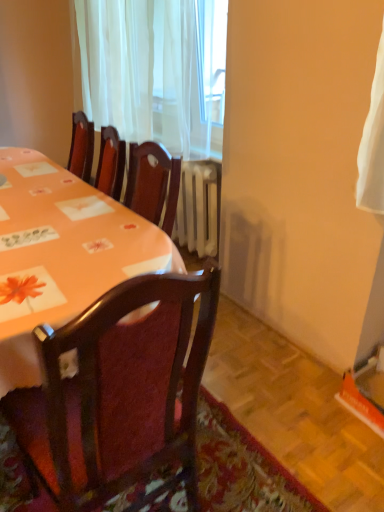
What is the approximate width of wooden chair at center?

22.69 inches.

You are a GUI agent. You are given a task and a screenshot of the screen. Output one action in this format:
    pyautogui.click(x=<x>, y=<y>)
    Task: Click on the white sheer curtain at upper center
    The width and height of the screenshot is (384, 512).
    Given the screenshot: What is the action you would take?
    pyautogui.click(x=156, y=71)

Find the location of a particular element. This screenshot has width=384, height=512. orange fabric table at upper left is located at coordinates (61, 254).

Is white sheer curtain at upper center smaller than wooden chair at center?

No, white sheer curtain at upper center is not smaller than wooden chair at center.

From the image's perspective, is white sheer curtain at upper center on wooden chair at center?

Yes, from the image's perspective, white sheer curtain at upper center is over wooden chair at center.

In terms of height, does white sheer curtain at upper center look taller or shorter compared to wooden chair at center?

In the image, white sheer curtain at upper center appears to be shorter than wooden chair at center.

Between white sheer curtain at upper center and wooden chair at center, which one is positioned behind?

white sheer curtain at upper center is behind.

Which of these two, white sheer curtain at upper center or orange fabric table at upper left, is thinner?

Thinner between the two is white sheer curtain at upper center.

Consider the image. How different are the orientations of white sheer curtain at upper center and orange fabric table at upper left in degrees?

0.211 degrees separate the facing orientations of white sheer curtain at upper center and orange fabric table at upper left.

From the picture: Is white sheer curtain at upper center inside or outside of orange fabric table at upper left?

The correct answer is: outside.

Considering the points (140, 73) and (48, 244), which point is in front, point (140, 73) or point (48, 244)?

The point (48, 244) is closer.

Does orange fabric table at upper left have a greater height compared to wooden chair at center?

No.

Is orange fabric table at upper left touching wooden chair at center?

They are not placed beside each other.

From the image's perspective, is orange fabric table at upper left on wooden chair at center?

Yes.

Which is more to the right, orange fabric table at upper left or wooden chair at center?

From the viewer's perspective, wooden chair at center appears more on the right side.

Is orange fabric table at upper left inside or outside of white sheer curtain at upper center?

orange fabric table at upper left exists outside the volume of white sheer curtain at upper center.

Considering the relative sizes of orange fabric table at upper left and white sheer curtain at upper center in the image provided, is orange fabric table at upper left taller than white sheer curtain at upper center?

No.

Would you say orange fabric table at upper left is a long distance from white sheer curtain at upper center?

No, orange fabric table at upper left is not far from white sheer curtain at upper center.

Considering the relative sizes of orange fabric table at upper left and white sheer curtain at upper center in the image provided, is orange fabric table at upper left smaller than white sheer curtain at upper center?

Correct, orange fabric table at upper left occupies less space than white sheer curtain at upper center.

Between wooden chair at center and orange fabric table at upper left, which one has larger size?

wooden chair at center is bigger.

Considering the sizes of objects wooden chair at center and orange fabric table at upper left in the image provided, who is shorter, wooden chair at center or orange fabric table at upper left?

With less height is orange fabric table at upper left.

Considering the sizes of objects wooden chair at center and orange fabric table at upper left in the image provided, who is thinner, wooden chair at center or orange fabric table at upper left?

orange fabric table at upper left is thinner.

Which object is more forward, wooden chair at center or white sheer curtain at upper center?

wooden chair at center.

Considering the sizes of objects wooden chair at center and white sheer curtain at upper center in the image provided, who is taller, wooden chair at center or white sheer curtain at upper center?

Standing taller between the two is wooden chair at center.

Is wooden chair at center next to white sheer curtain at upper center?

No, wooden chair at center is not next to white sheer curtain at upper center.

At what (x,y) coordinates should I click in order to perform the action: click on chair beneath the white sheer curtain at upper center (from a real-world perspective). Please return your answer as a coordinate pair (x, y). Image resolution: width=384 pixels, height=512 pixels. Looking at the image, I should click on (118, 393).

Identify the location of curtain behind the orange fabric table at upper left. (156, 71).

Based on their spatial positions, is wooden chair at center or white sheer curtain at upper center closer to orange fabric table at upper left?

wooden chair at center lies closer to orange fabric table at upper left than the other object.

Considering their positions, is orange fabric table at upper left positioned further to white sheer curtain at upper center than wooden chair at center?

The object further to white sheer curtain at upper center is wooden chair at center.

Estimate the real-world distances between objects in this image. Which object is further from wooden chair at center, orange fabric table at upper left or white sheer curtain at upper center?

white sheer curtain at upper center is positioned further to the anchor wooden chair at center.

Based on their spatial positions, is white sheer curtain at upper center or wooden chair at center closer to orange fabric table at upper left?

wooden chair at center is positioned closer to the anchor orange fabric table at upper left.

Estimate the real-world distances between objects in this image. Which object is further from white sheer curtain at upper center, wooden chair at center or orange fabric table at upper left?

wooden chair at center is further to white sheer curtain at upper center.

Which object lies further to the anchor point wooden chair at center, white sheer curtain at upper center or orange fabric table at upper left?

white sheer curtain at upper center.

Image resolution: width=384 pixels, height=512 pixels. Find the location of `desk that lies between white sheer curtain at upper center and wooden chair at center from top to bottom`. desk that lies between white sheer curtain at upper center and wooden chair at center from top to bottom is located at coordinates (61, 254).